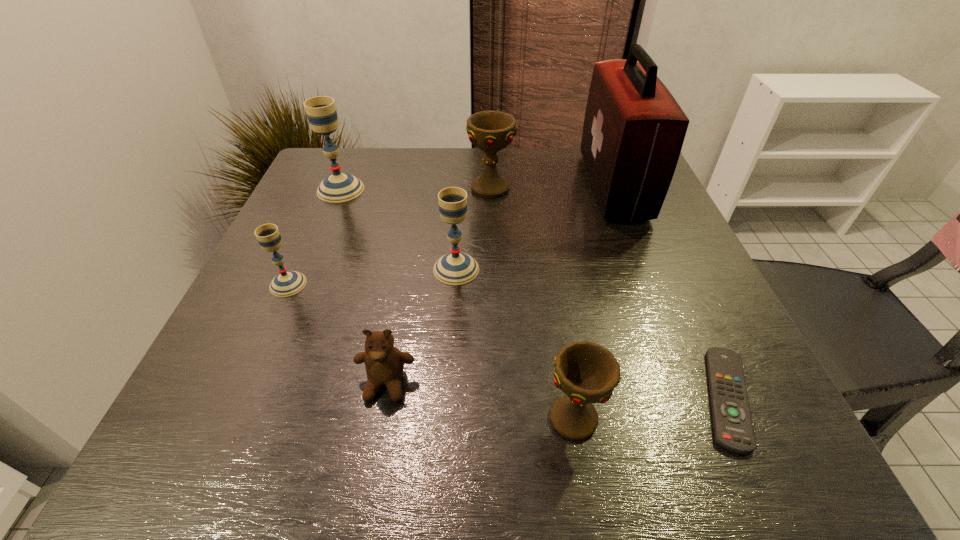
This screenshot has height=540, width=960. I want to click on free space between the nearest chalice and the rightmost gray chalice, so click(x=515, y=343).

In order to click on free spot between the farther red chalice and the right red chalice in this screenshot , I will do `click(532, 303)`.

Identify the location of free space between the red first aid kit and the bigger red chalice. This screenshot has width=960, height=540. (552, 187).

Where is `free space between the red first aid kit and the shortest object`? The height and width of the screenshot is (540, 960). free space between the red first aid kit and the shortest object is located at coordinates (670, 292).

This screenshot has height=540, width=960. I want to click on free space that is in between the second shortest object and the remote control, so point(557,391).

This screenshot has width=960, height=540. What are the coordinates of `free spot between the rightmost gray chalice and the bigger red chalice` in the screenshot? It's located at (473, 229).

You are a GUI agent. You are given a task and a screenshot of the screen. Output one action in this format:
    pyautogui.click(x=<x>, y=<y>)
    Task: Click on the object that is the fourth closest to the sixth object from left to right
    The image size is (960, 540).
    Given the screenshot: What is the action you would take?
    pyautogui.click(x=634, y=129)

Identify the location of object that can be found as the third closest to the right red chalice. (455, 268).

Identify which chalice is the nearest to the rightmost gray chalice. Please provide its 2D coordinates. Your answer should be formatted as a tuple, i.e. [(x, y)], where the tuple contains the x and y coordinates of a point satisfying the conditions above.

[(491, 131)]

This screenshot has width=960, height=540. Identify the location of chalice that is the fourth nearest to the smallest gray chalice. (587, 373).